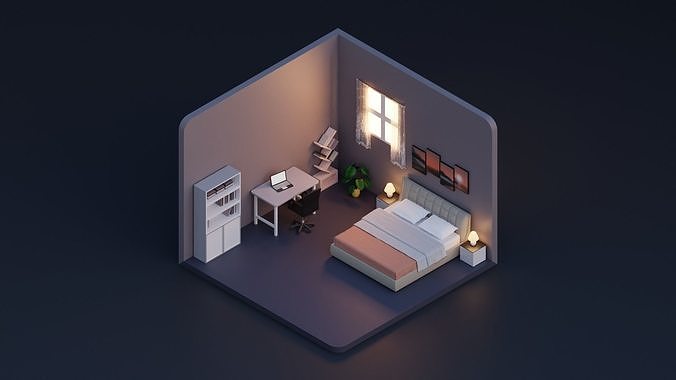
Find the location of a particular element. This screenshot has height=380, width=676. desk is located at coordinates (276, 200).